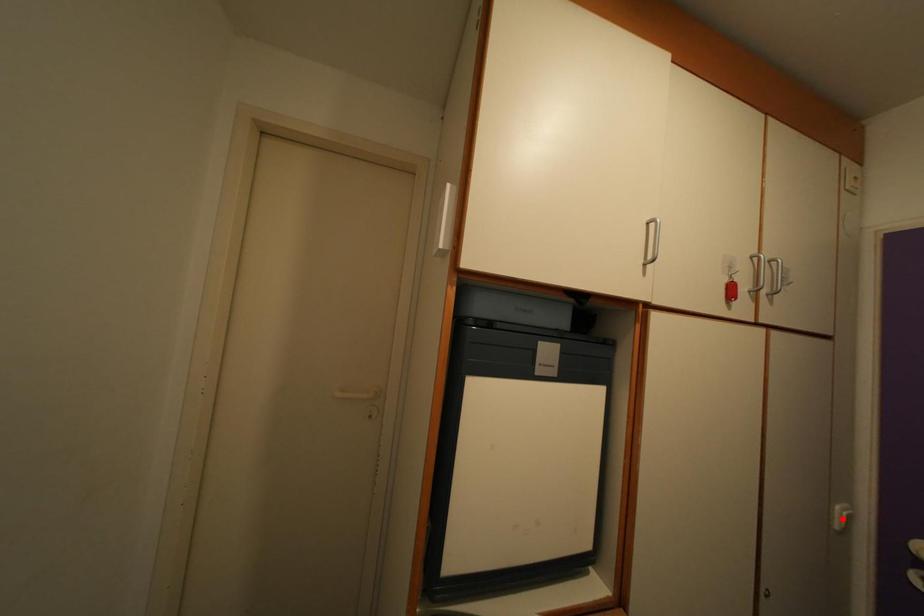
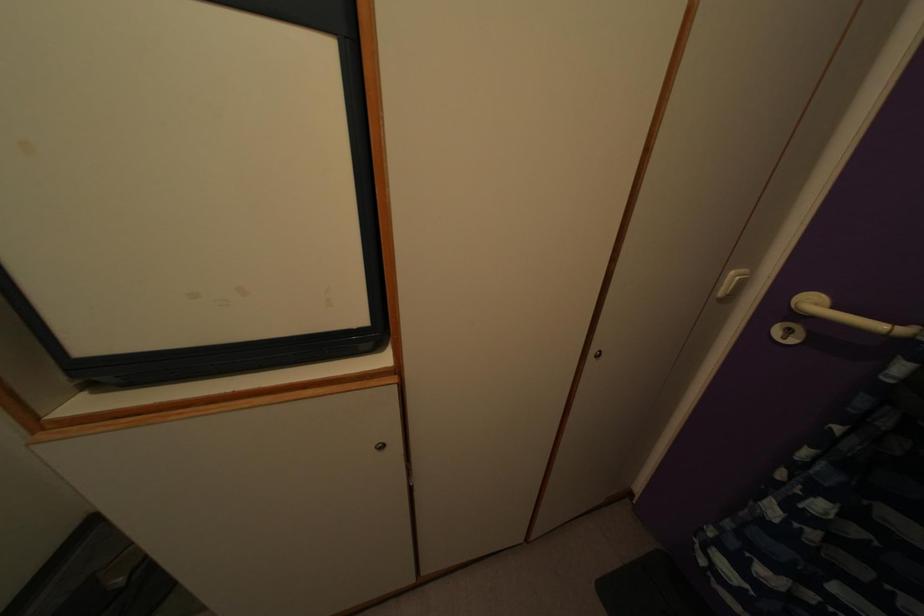
Find the pixel in the second image that matches the highlighted location in the first image.

(736, 284)